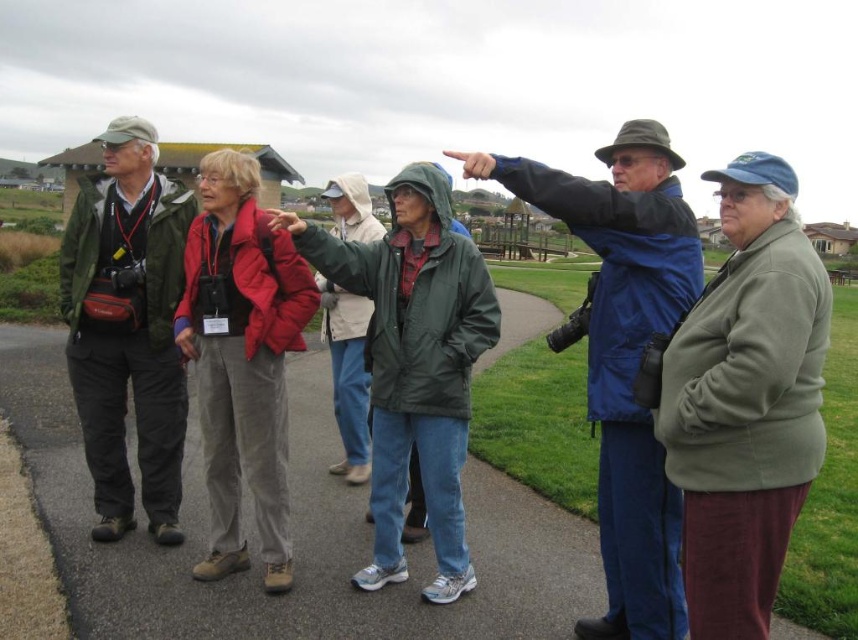
Is asphalt at center behind blue matte jacket at upper center?

Yes, it is behind blue matte jacket at upper center.

Image resolution: width=858 pixels, height=640 pixels. In order to click on asphalt at center in this screenshot , I will do pyautogui.click(x=293, y=532).

Identify the location of asphalt at center. This screenshot has height=640, width=858. (293, 532).

Between blue matte jacket at upper center and green matte jacket at center, which one is positioned higher?

blue matte jacket at upper center is above.

Measure the distance between point (617, 448) and camera.

7.15 meters

The width and height of the screenshot is (858, 640). Find the location of `blue matte jacket at upper center`. blue matte jacket at upper center is located at coordinates (624, 355).

Where is `blue matte jacket at upper center`? The image size is (858, 640). blue matte jacket at upper center is located at coordinates (624, 355).

From the picture: Is asphalt at center bigger than green fleece jacket at right?

Indeed, asphalt at center has a larger size compared to green fleece jacket at right.

Measure the distance between asphalt at center and green fleece jacket at right.

asphalt at center and green fleece jacket at right are 9.01 meters apart from each other.

Which is in front, point (254, 621) or point (684, 506)?

Point (684, 506) is more forward.

I want to click on asphalt at center, so click(x=293, y=532).